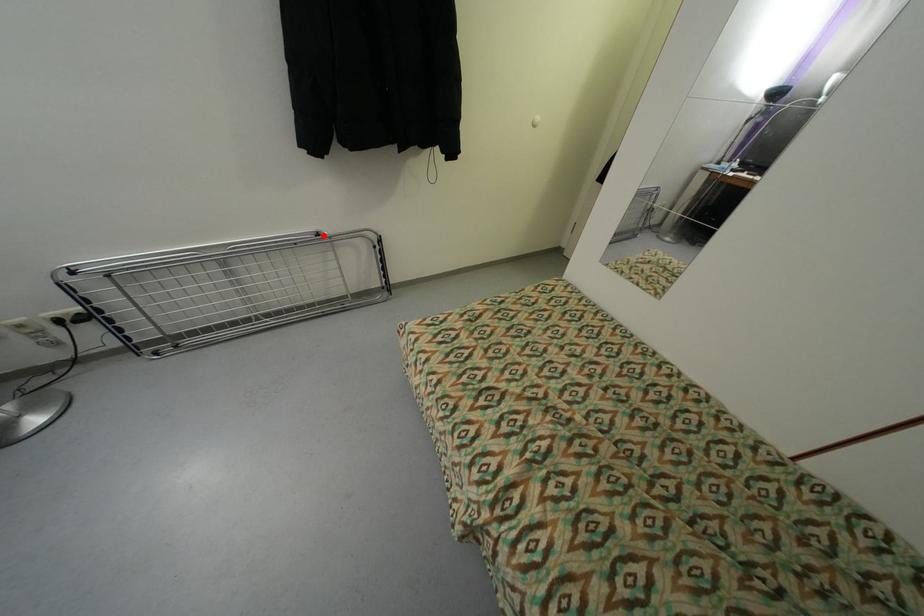
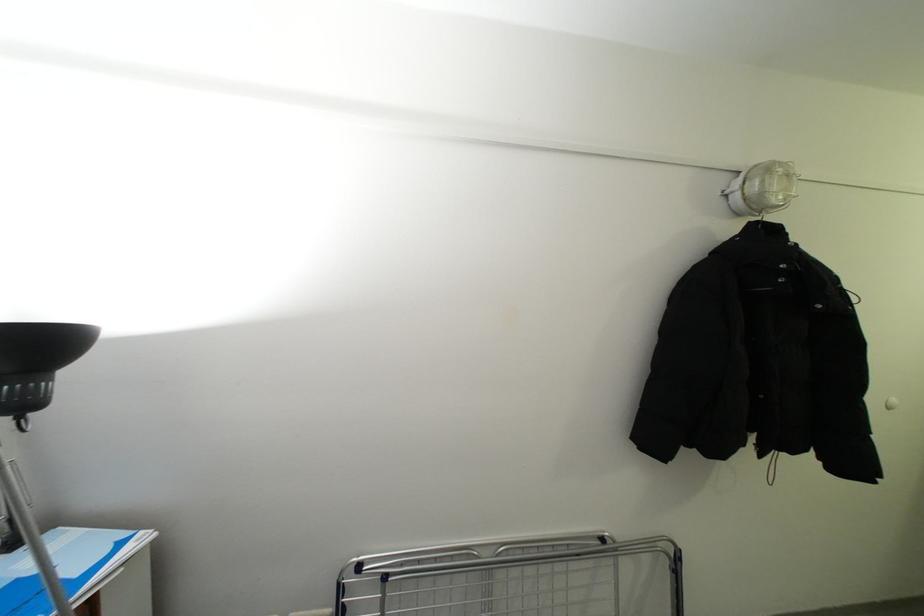
Question: I am providing you with two images of the same scene from different viewpoints. A red point is shown in image1. For the corresponding object point in image2, is it positioned nearer or farther from the camera?

Choices:
 (A) Nearer
 (B) Farther

Answer: (B)